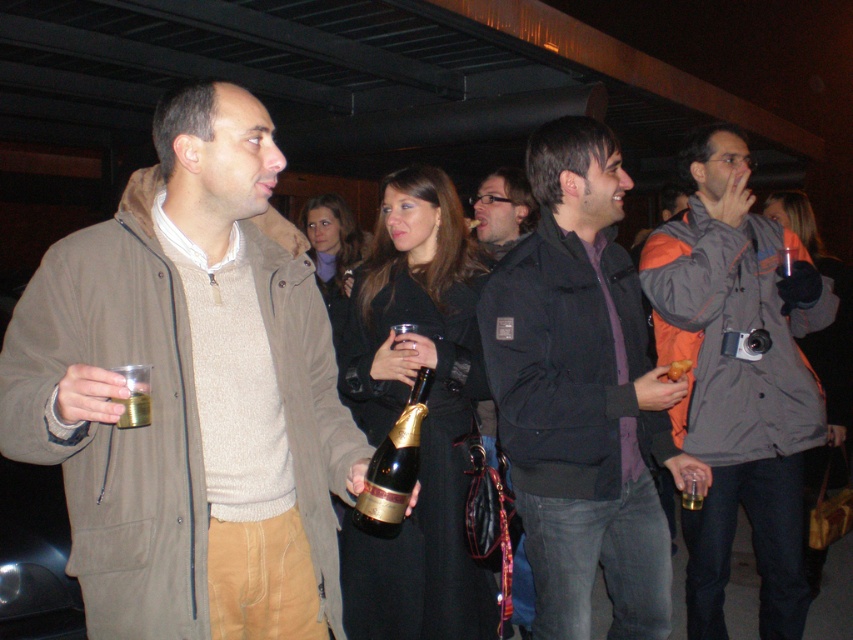
Question: Which point is farther from the camera taking this photo?

Choices:
 (A) (717, 616)
 (B) (524, 189)

Answer: (B)

Question: Which object is positioned farthest from the matte khaki jacket at left?

Choices:
 (A) matte black jacket at center
 (B) gray fabric jacket at right
 (C) translucent glass bottle at center

Answer: (A)

Question: In this image, where is gray fabric jacket at right located relative to translucent glass bottle at center?

Choices:
 (A) left
 (B) right

Answer: (B)

Question: Is black matte jacket at center in front of gold foil champagne bottle at center?

Choices:
 (A) yes
 (B) no

Answer: (B)

Question: Based on their relative distances, which object is farther from the matte khaki jacket at left?

Choices:
 (A) gray fabric jacket at right
 (B) black matte jacket at center

Answer: (A)

Question: Does matte khaki jacket at left appear under black matte jacket at center?

Choices:
 (A) yes
 (B) no

Answer: (B)